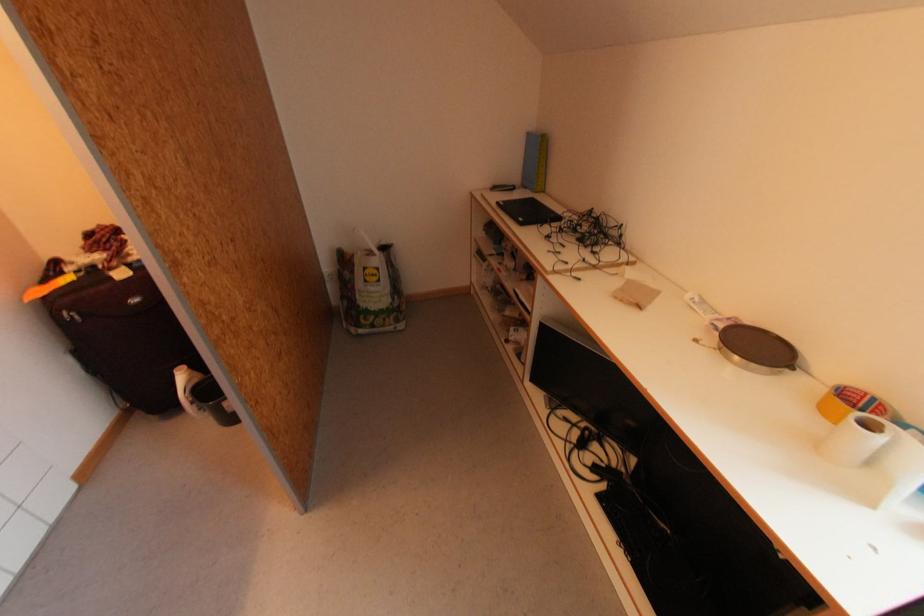
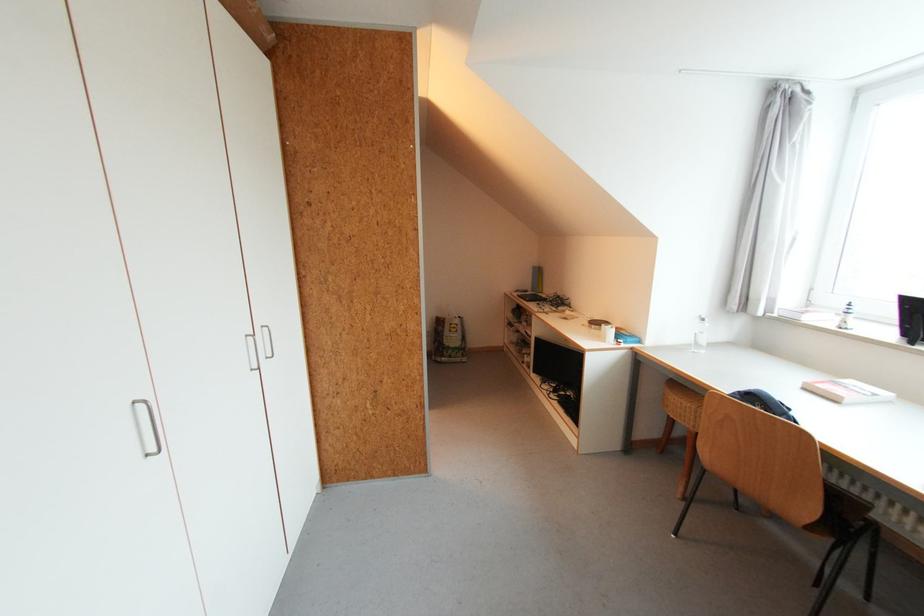
Question: In a continuous first-person perspective shot, in which direction is the camera moving?

Choices:
 (A) Left
 (B) Right
 (C) Forward
 (D) Backward

Answer: (D)